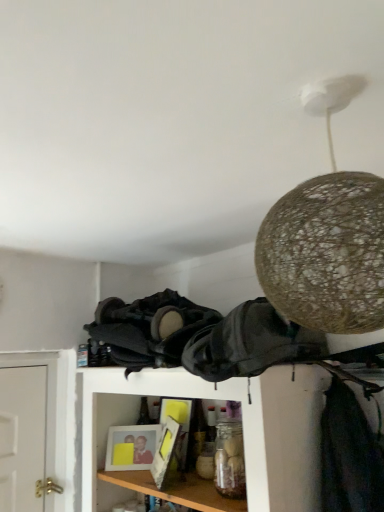
Question: Can you confirm if black leather backpack at center, which ranks as the 1th clothing in right-to-left order, is taller than black fabric at center, acting as the second clothing starting from the right?

Choices:
 (A) no
 (B) yes

Answer: (A)

Question: Is there a large distance between black leather backpack at center, which ranks as the 1th clothing in right-to-left order, and black fabric at center, which is the first clothing from left to right?

Choices:
 (A) yes
 (B) no

Answer: (B)

Question: Is black leather backpack at center, which ranks as the 1th clothing in right-to-left order, positioned in front of black fabric at center, which is the first clothing from left to right?

Choices:
 (A) yes
 (B) no

Answer: (A)

Question: Can we say black leather backpack at center, which is the second clothing in left-to-right order, lies outside black fabric at center, which is the first clothing from left to right?

Choices:
 (A) yes
 (B) no

Answer: (A)

Question: Considering the relative sizes of black leather backpack at center, which ranks as the 1th clothing in right-to-left order, and black fabric at center, which is the first clothing from left to right, in the image provided, is black leather backpack at center, which ranks as the 1th clothing in right-to-left order, wider than black fabric at center, which is the first clothing from left to right,?

Choices:
 (A) no
 (B) yes

Answer: (B)

Question: Is point (119, 450) closer or farther from the camera than point (155, 313)?

Choices:
 (A) farther
 (B) closer

Answer: (A)

Question: From a real-world perspective, is matte plastic picture frame at lower center positioned above or below black fabric at center, which is the first clothing from left to right?

Choices:
 (A) below
 (B) above

Answer: (A)

Question: Is matte plastic picture frame at lower center inside the boundaries of black fabric at center, acting as the second clothing starting from the right, or outside?

Choices:
 (A) outside
 (B) inside

Answer: (A)

Question: From the image's perspective, is matte plastic picture frame at lower center located above or below black fabric at center, acting as the second clothing starting from the right?

Choices:
 (A) above
 (B) below

Answer: (B)

Question: Is black fabric at center, acting as the second clothing starting from the right, bigger or smaller than matte plastic picture frame at lower center?

Choices:
 (A) small
 (B) big

Answer: (B)

Question: From the image's perspective, is black fabric at center, which is the first clothing from left to right, above or below matte plastic picture frame at lower center?

Choices:
 (A) below
 (B) above

Answer: (B)

Question: From their relative heights in the image, would you say black fabric at center, acting as the second clothing starting from the right, is taller or shorter than matte plastic picture frame at lower center?

Choices:
 (A) short
 (B) tall

Answer: (B)

Question: Is point coord(99,360) closer or farther from the camera than point coord(139,459)?

Choices:
 (A) closer
 (B) farther

Answer: (A)

Question: In terms of height, does black fabric at center, which is the first clothing from left to right, look taller or shorter compared to woven beige lampshade at upper right?

Choices:
 (A) short
 (B) tall

Answer: (A)

Question: In the image, is black fabric at center, which is the first clothing from left to right, positioned in front of or behind woven beige lampshade at upper right?

Choices:
 (A) front
 (B) behind

Answer: (B)